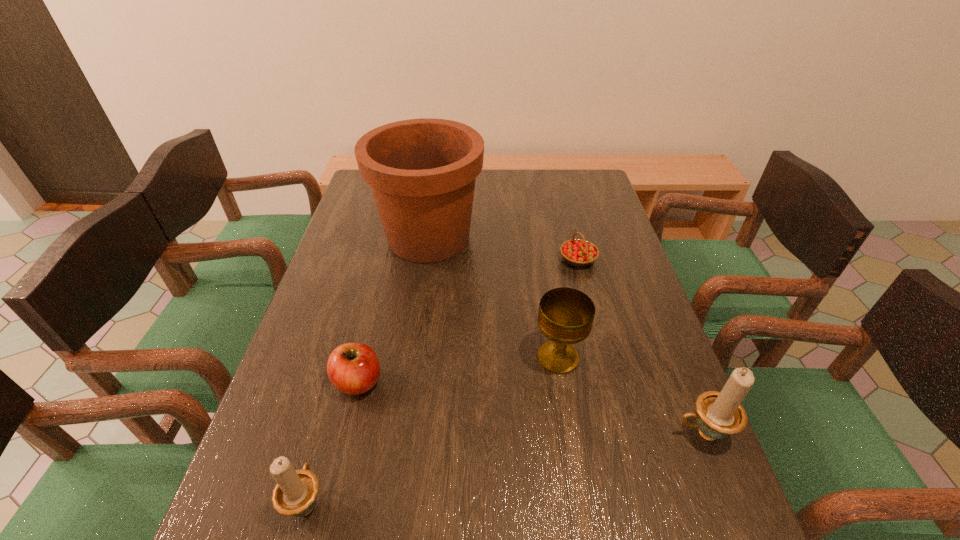
Identify the location of vacant region located on the handle side of the nearest object. (336, 399).

You are a GUI agent. You are given a task and a screenshot of the screen. Output one action in this format:
    pyautogui.click(x=<x>, y=<y>)
    Task: Click on the free space located on the handle side of the fifth farthest object
    The height and width of the screenshot is (540, 960).
    Given the screenshot: What is the action you would take?
    (x=566, y=434)

What are the coordinates of `vacant space located on the handle side of the fifth farthest object` in the screenshot? It's located at (615, 434).

The image size is (960, 540). I want to click on vacant region located on the handle side of the fifth farthest object, so click(x=493, y=434).

This screenshot has width=960, height=540. I want to click on vacant area situated 0.150m on the front of the shortest object, so click(x=591, y=309).

The image size is (960, 540). I want to click on free location located on the back of the tallest object, so (x=438, y=172).

I want to click on vacant space situated on the back of the fifth tallest object, so [x=370, y=336].

Locate an element on the screen. The width and height of the screenshot is (960, 540). vacant space located 0.160m on the back of the chalice is located at coordinates (547, 293).

This screenshot has height=540, width=960. Identify the location of object at the near edge. (295, 494).

The width and height of the screenshot is (960, 540). What are the coordinates of `candle_holder at the left edge` in the screenshot? It's located at (295, 494).